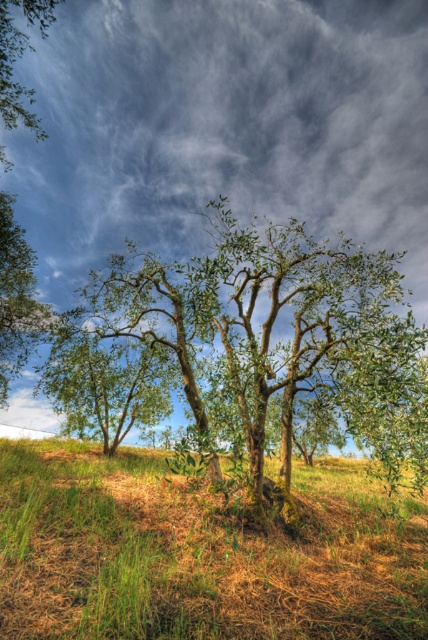
Question: In this image, where is green grass at lower left located relative to green leafy tree at center?

Choices:
 (A) above
 (B) below

Answer: (B)

Question: Does green grass at lower left appear under green leafy tree at center?

Choices:
 (A) no
 (B) yes

Answer: (B)

Question: Among these points, which one is farthest from the camera?

Choices:
 (A) (0, 336)
 (B) (382, 449)

Answer: (A)

Question: Which point is farther from the camera taking this photo?

Choices:
 (A) (290, 474)
 (B) (29, 317)

Answer: (B)

Question: Which point is closer to the camera?

Choices:
 (A) green leafy tree at left
 (B) green leafy tree at center
 (C) green grass at lower left

Answer: (C)

Question: From the image, what is the correct spatial relationship of green grass at lower left in relation to green leafy tree at left?

Choices:
 (A) right
 (B) left

Answer: (A)